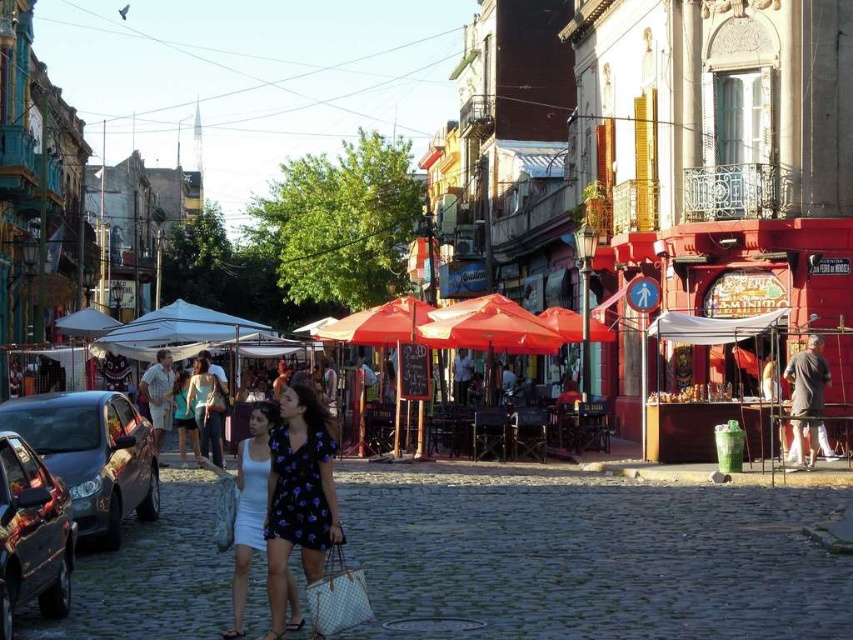
Question: Does shiny metallic car at left appear over floral print dress at center?

Choices:
 (A) no
 (B) yes

Answer: (B)

Question: Is the position of light brown fabric shirt at center less distant than that of matte blue dress at center?

Choices:
 (A) no
 (B) yes

Answer: (B)

Question: Which object is positioned farthest from the matte blue dress at center?

Choices:
 (A) light brown fabric shirt at center
 (B) floral print dress at center
 (C) shiny metallic car at left
 (D) dark gray fabric pants at right

Answer: (D)

Question: Estimate the real-world distances between objects in this image. Which object is closer to the shiny metallic car at left?

Choices:
 (A) matte red umbrella at center
 (B) matte blue dress at center

Answer: (B)

Question: Based on their relative distances, which object is nearer to the white fabric dress at center?

Choices:
 (A) matte blue dress at center
 (B) dark gray fabric pants at right
 (C) shiny metallic car at lower left
 (D) matte red umbrella at center

Answer: (C)

Question: Is floral print dress at center positioned before light brown fabric shirt at center?

Choices:
 (A) no
 (B) yes

Answer: (B)